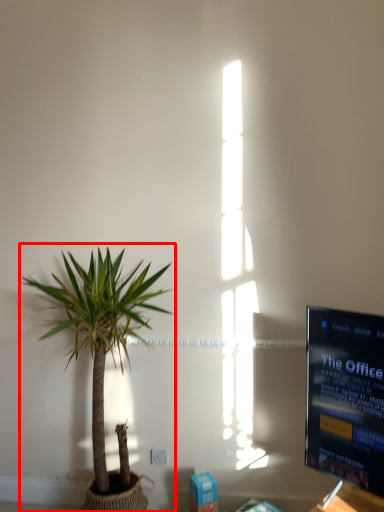
Question: From the image's perspective, what is the correct spatial relationship of houseplant (annotated by the red box) in relation to electric outlet?

Choices:
 (A) below
 (B) above

Answer: (B)